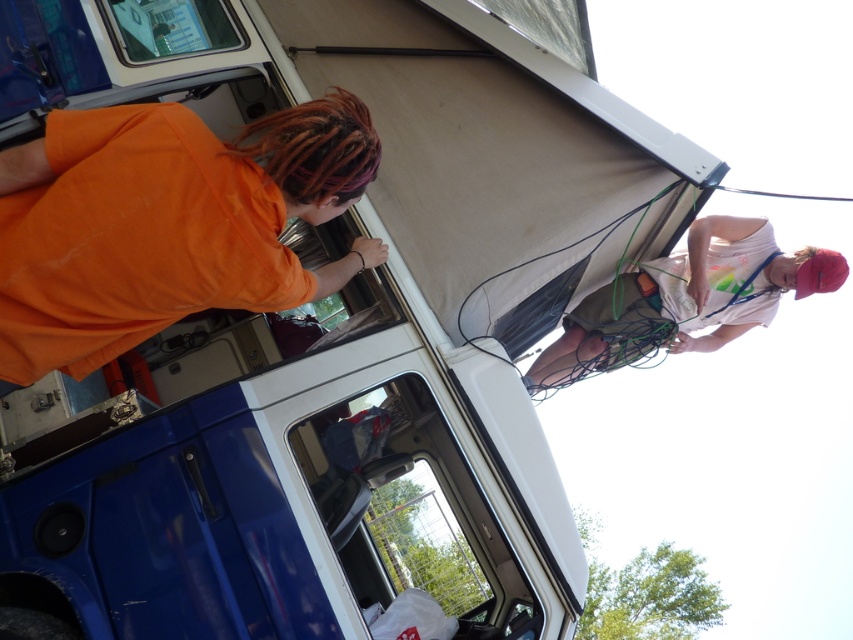
Does orange cotton shirt at left have a lesser height compared to white cotton shirt at upper right?

Incorrect, orange cotton shirt at left's height does not fall short of white cotton shirt at upper right's.

Is orange cotton shirt at left above white cotton shirt at upper right?

Yes, orange cotton shirt at left is above white cotton shirt at upper right.

The height and width of the screenshot is (640, 853). What do you see at coordinates (166, 225) in the screenshot?
I see `orange cotton shirt at left` at bounding box center [166, 225].

Identify the location of orange cotton shirt at left. (166, 225).